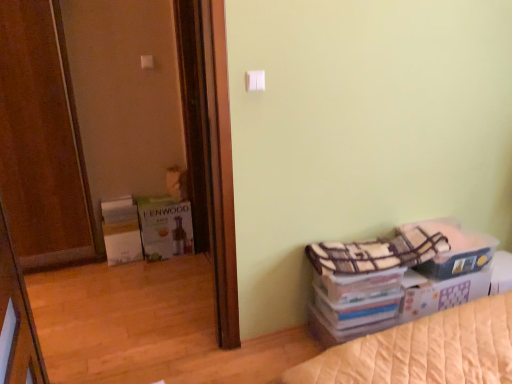
Question: Which direction should I rotate to look at white plastic light switch at upper center, which ranks as the 2th light switch in bottom-to-top order?

Choices:
 (A) left
 (B) right

Answer: (A)

Question: Can you confirm if wooden door at left is bigger than brown wooden screen door at left?

Choices:
 (A) yes
 (B) no

Answer: (A)

Question: Considering the relative sizes of wooden door at left and brown wooden screen door at left in the image provided, is wooden door at left wider than brown wooden screen door at left?

Choices:
 (A) yes
 (B) no

Answer: (A)

Question: Is the position of wooden door at left less distant than that of brown wooden screen door at left?

Choices:
 (A) no
 (B) yes

Answer: (B)

Question: Is wooden door at left next to brown wooden screen door at left?

Choices:
 (A) no
 (B) yes

Answer: (A)

Question: Is brown wooden screen door at left surrounded by wooden door at left?

Choices:
 (A) yes
 (B) no

Answer: (B)

Question: Is wooden door at left turned away from brown wooden screen door at left?

Choices:
 (A) yes
 (B) no

Answer: (B)

Question: Considering the relative sizes of plaid fabric storage box at lower right and brown wooden screen door at left in the image provided, is plaid fabric storage box at lower right wider than brown wooden screen door at left?

Choices:
 (A) no
 (B) yes

Answer: (B)

Question: Is plaid fabric storage box at lower right outside of brown wooden screen door at left?

Choices:
 (A) no
 (B) yes

Answer: (B)

Question: Is plaid fabric storage box at lower right looking in the opposite direction of brown wooden screen door at left?

Choices:
 (A) yes
 (B) no

Answer: (B)

Question: Could you tell me if plaid fabric storage box at lower right is facing brown wooden screen door at left?

Choices:
 (A) no
 (B) yes

Answer: (A)

Question: From the image's perspective, is plaid fabric storage box at lower right below brown wooden screen door at left?

Choices:
 (A) no
 (B) yes

Answer: (B)

Question: From a real-world perspective, is plaid fabric storage box at lower right located higher than brown wooden screen door at left?

Choices:
 (A) yes
 (B) no

Answer: (B)

Question: Is white plastic light switch at upper center, the first light switch viewed from the top, at the back of plaid fabric storage box at lower right?

Choices:
 (A) no
 (B) yes

Answer: (A)